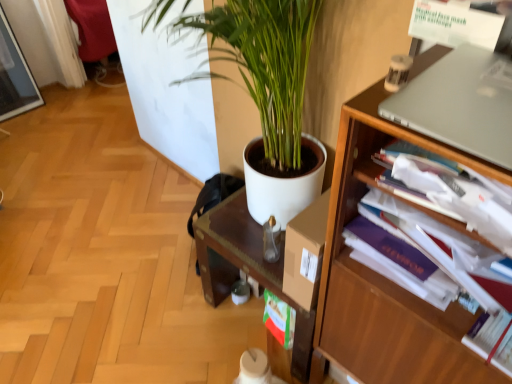
Question: Is purple paperback book at right directly adjacent to wooden bookshelf at right?

Choices:
 (A) no
 (B) yes

Answer: (A)

Question: Can you confirm if purple paperback book at right is bigger than wooden bookshelf at right?

Choices:
 (A) yes
 (B) no

Answer: (B)

Question: Can you confirm if purple paperback book at right is taller than wooden bookshelf at right?

Choices:
 (A) yes
 (B) no

Answer: (B)

Question: Is purple paperback book at right looking in the opposite direction of wooden bookshelf at right?

Choices:
 (A) yes
 (B) no

Answer: (A)

Question: Does purple paperback book at right come in front of wooden bookshelf at right?

Choices:
 (A) yes
 (B) no

Answer: (B)

Question: Looking at the image, does wooden bookshelf at right seem bigger or smaller compared to purple paperback book at right?

Choices:
 (A) small
 (B) big

Answer: (B)

Question: Is point (353, 294) closer or farther from the camera than point (473, 190)?

Choices:
 (A) farther
 (B) closer

Answer: (A)

Question: Relative to purple paperback book at right, is wooden bookshelf at right in front or behind?

Choices:
 (A) behind
 (B) front

Answer: (B)

Question: From their relative heights in the image, would you say wooden bookshelf at right is taller or shorter than purple paperback book at right?

Choices:
 (A) tall
 (B) short

Answer: (A)

Question: Based on their sizes in the image, would you say silver metallic laptop at upper right is bigger or smaller than wooden bookshelf at right?

Choices:
 (A) small
 (B) big

Answer: (A)

Question: Is silver metallic laptop at upper right to the left or to the right of wooden bookshelf at right in the image?

Choices:
 (A) left
 (B) right

Answer: (A)

Question: From the image's perspective, is silver metallic laptop at upper right above or below wooden bookshelf at right?

Choices:
 (A) above
 (B) below

Answer: (A)

Question: From a real-world perspective, relative to wooden bookshelf at right, is silver metallic laptop at upper right vertically above or below?

Choices:
 (A) above
 (B) below

Answer: (A)

Question: From a real-world perspective, relative to wooden bookshelf at right, is white matte plant pot at center vertically above or below?

Choices:
 (A) above
 (B) below

Answer: (B)

Question: From the image's perspective, is white matte plant pot at center above or below wooden bookshelf at right?

Choices:
 (A) below
 (B) above

Answer: (A)